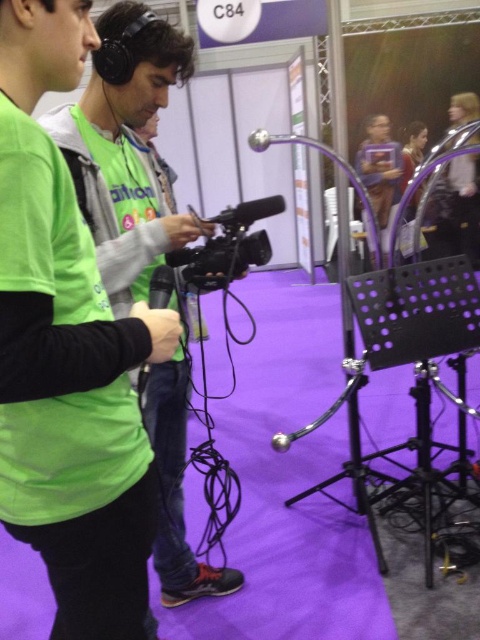
Who is more distant from viewer, (135, 10) or (215, 276)?

The point (215, 276) is more distant.

The width and height of the screenshot is (480, 640). What do you see at coordinates (126, 148) in the screenshot?
I see `green matte shirt at center` at bounding box center [126, 148].

Where is `green matte shirt at center`? green matte shirt at center is located at coordinates (126, 148).

The image size is (480, 640). In order to click on green matte shirt at center in this screenshot , I will do `click(126, 148)`.